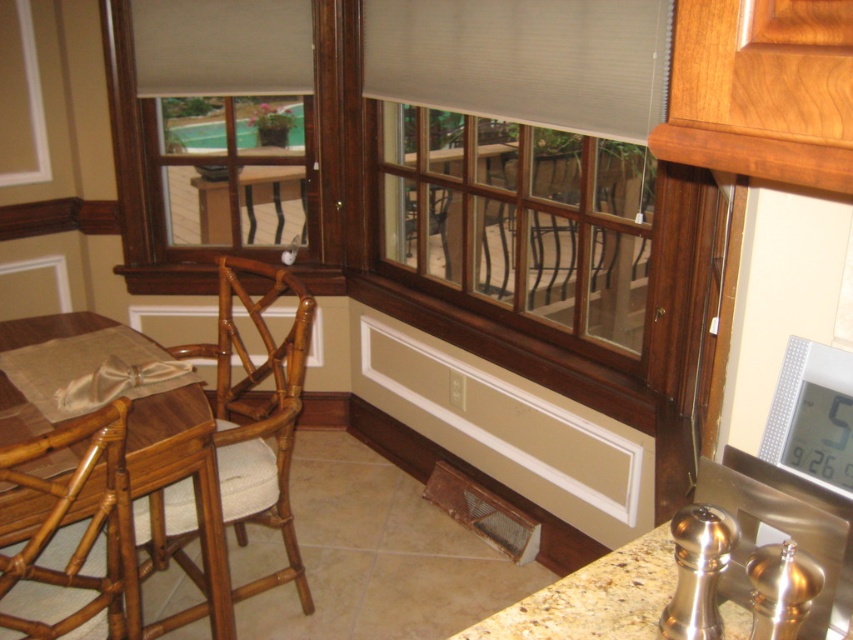
Question: Among these objects, which one is nearest to the camera?

Choices:
 (A) granite countertop at lower right
 (B) bamboo chair at left
 (C) natural wood chair at left

Answer: (A)

Question: Which of the following is the closest to the observer?

Choices:
 (A) granite countertop at lower right
 (B) natural wood chair at left
 (C) matte wood bay window at left
 (D) matte wood window at center

Answer: (A)

Question: Does matte wood window at center appear on the left side of matte wood bay window at left?

Choices:
 (A) no
 (B) yes

Answer: (A)

Question: Is matte wood window at center positioned in front of bamboo table at left?

Choices:
 (A) yes
 (B) no

Answer: (B)

Question: Which is farther from the granite countertop at lower right?

Choices:
 (A) bamboo chair at left
 (B) bamboo table at left
 (C) natural wood chair at left
 (D) matte wood window at center

Answer: (D)

Question: Is bamboo chair at left to the left of bamboo table at left from the viewer's perspective?

Choices:
 (A) no
 (B) yes

Answer: (B)